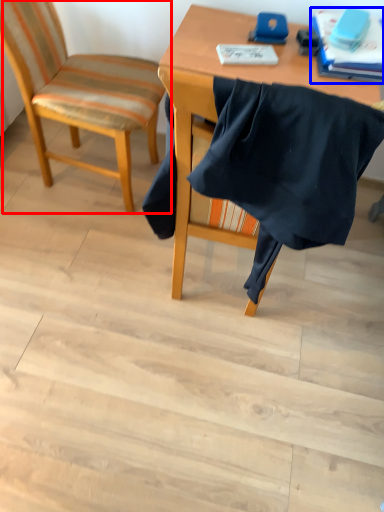
Question: Which object is closer to the camera taking this photo, chair (highlighted by a red box) or book (highlighted by a blue box)?

Choices:
 (A) chair
 (B) book

Answer: (A)